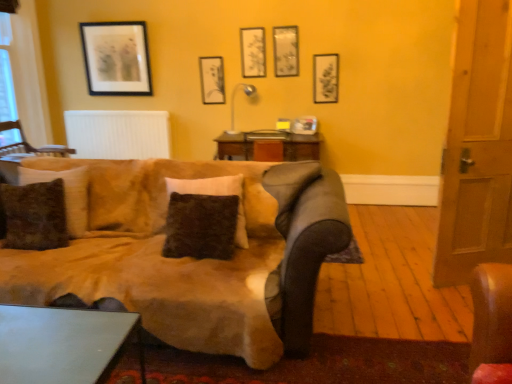
The image size is (512, 384). I want to click on vacant space situated on the left part of wooden door at right, so click(390, 274).